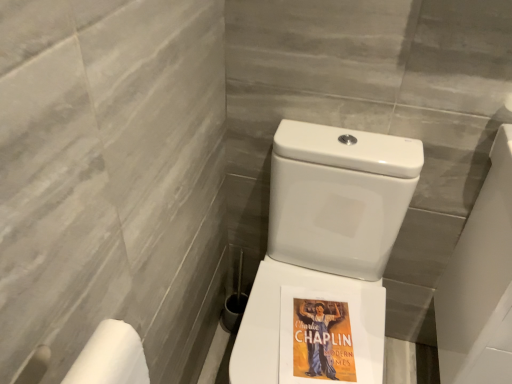
Question: From their relative heights in the image, would you say white matte toilet paper at lower left is taller or shorter than white glossy porcelain at right?

Choices:
 (A) tall
 (B) short

Answer: (B)

Question: Visually, is white matte toilet paper at lower left positioned to the left or to the right of white glossy porcelain at right?

Choices:
 (A) left
 (B) right

Answer: (A)

Question: Considering the real-world distances, which object is farthest from the white matte toilet paper at lower left?

Choices:
 (A) white glossy porcelain at right
 (B) white glossy toilet at center

Answer: (A)

Question: Based on their relative distances, which object is farther from the white matte toilet paper at lower left?

Choices:
 (A) white glossy porcelain at right
 (B) white glossy toilet at center

Answer: (A)